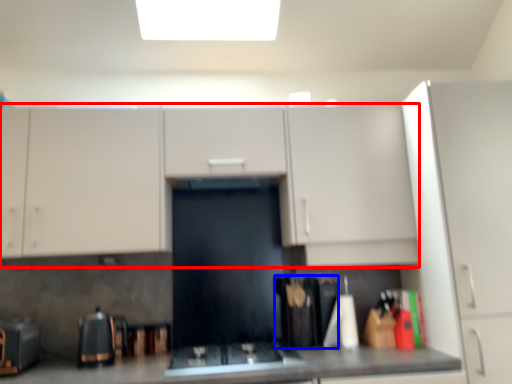
Question: Which object appears closest to the camera in this image, cabinetry (highlighted by a red box) or appliance (highlighted by a blue box)?

Choices:
 (A) cabinetry
 (B) appliance

Answer: (A)